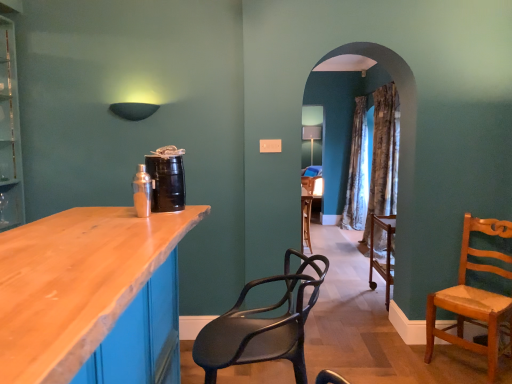
You are a GUI agent. You are given a task and a screenshot of the screen. Output one action in this format:
    pyautogui.click(x=<x>, y=<y>)
    Task: Click on the vacant space that is to the left of light brown wooden chair at right, arranged as the 1th chair when viewed from the back
    
    Given the screenshot: What is the action you would take?
    pyautogui.click(x=407, y=357)